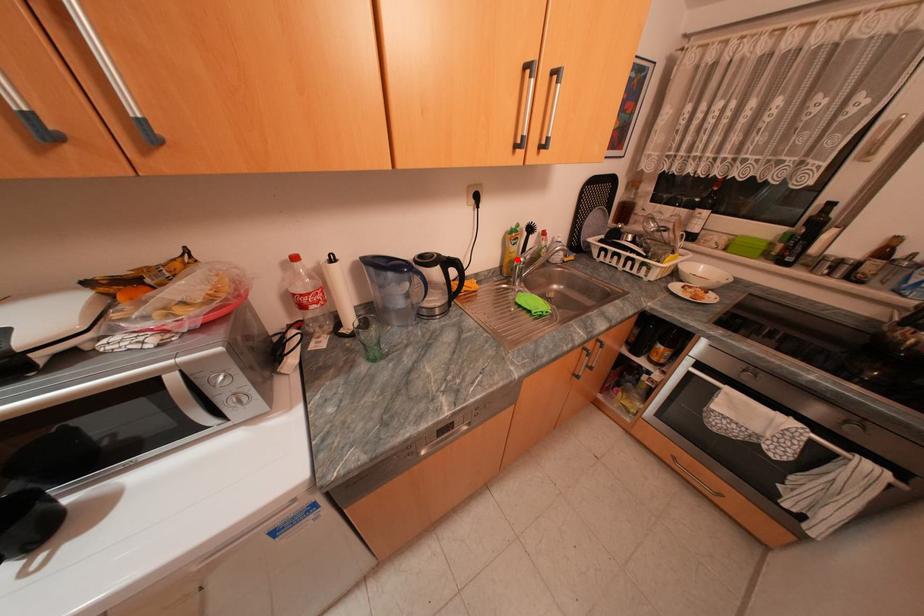
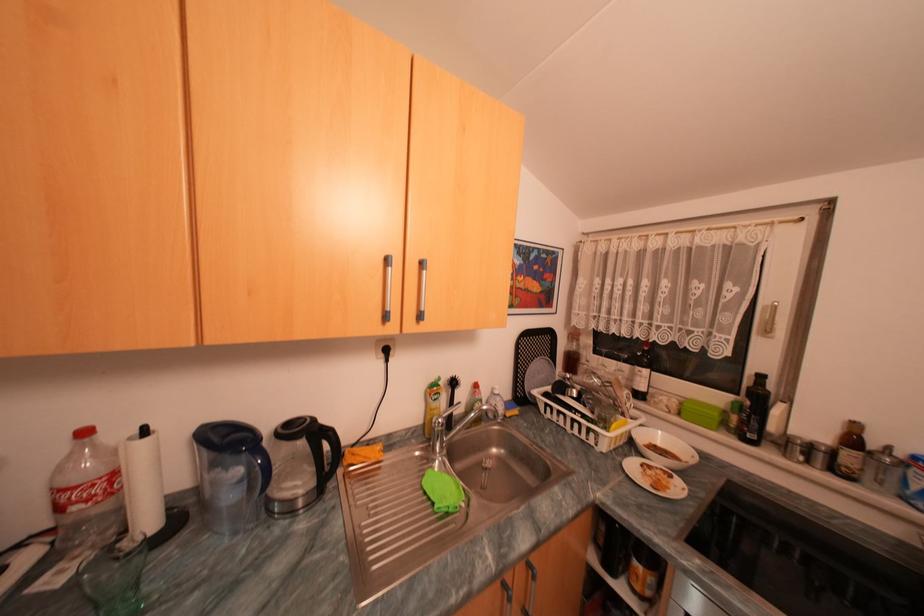
Where in the second image is the point corresponding to the highlighted location from the first image?

(438, 416)